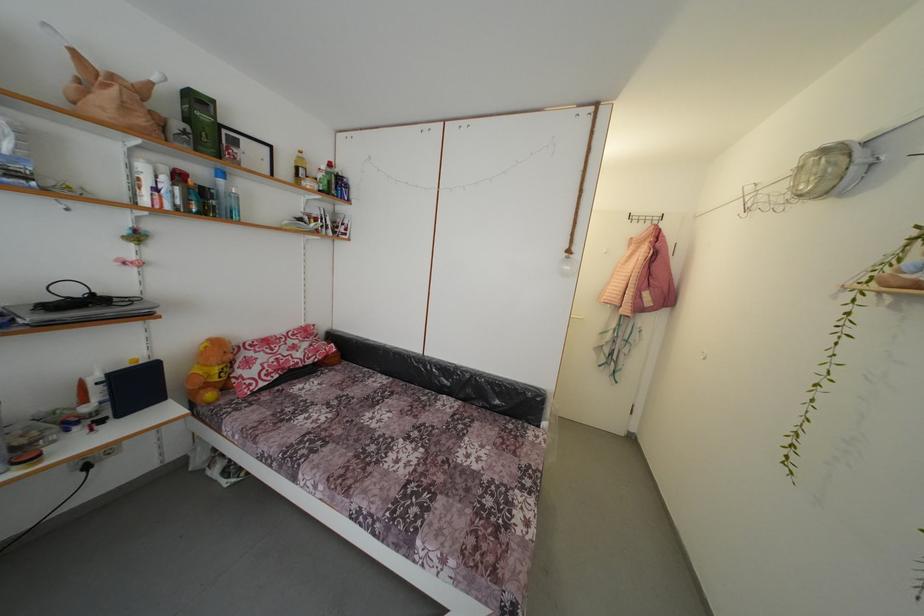
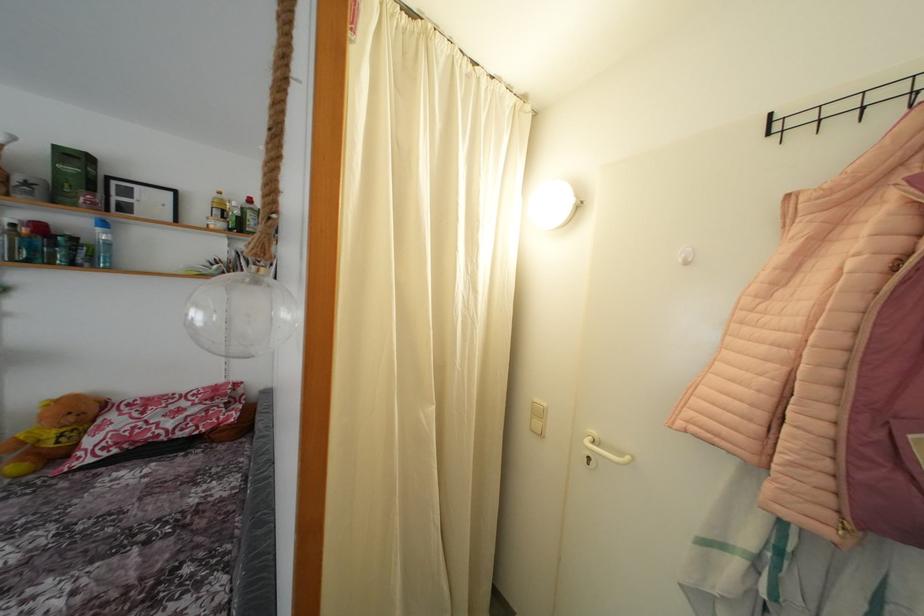
The point at (225, 187) is marked in the first image. Where is the corresponding point in the second image?

(104, 236)